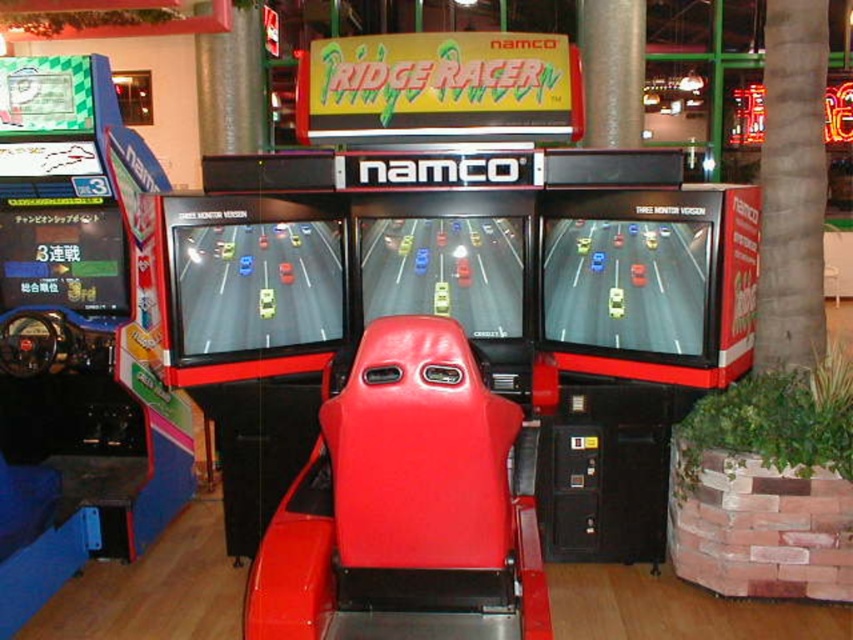
You are a game designer visiting an arcade and notice the gray textured pillar at center right and the shiny plastic arcade machine at center. Based on their positions, which object is closer to the ceiling?

The gray textured pillar at center right is above the shiny plastic arcade machine at center, so it is closer to the ceiling.

You are standing in the arcade and want to move from the gray textured pillar at center right to the shiny plastic arcade machine at center. Which direction should you move to reach it?

You should move to the left to reach the shiny plastic arcade machine at center since the gray textured pillar at center right is located to its right side.